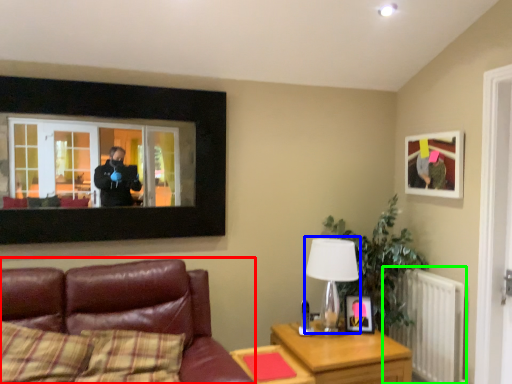
Question: Which object is the farthest from studio couch (highlighted by a red box)? Choose among these: table lamp (highlighted by a blue box) or radiator (highlighted by a green box).

Choices:
 (A) table lamp
 (B) radiator

Answer: (B)